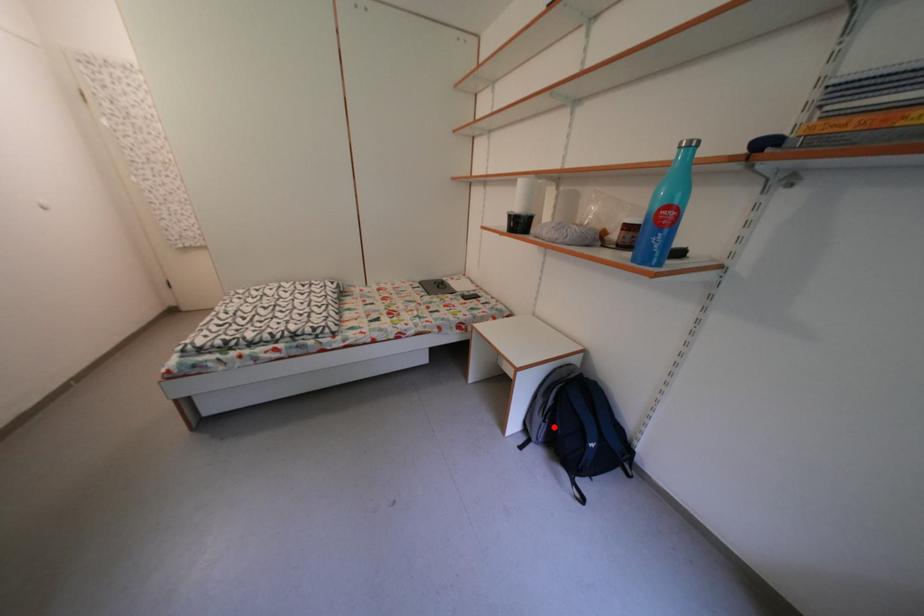
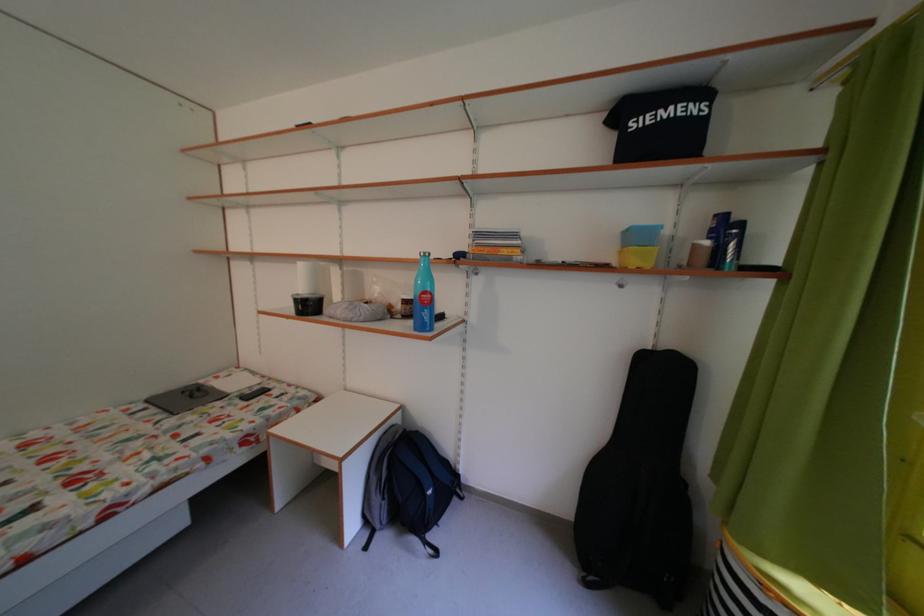
Question: I am providing you with two images of the same scene from different viewpoints. A red point is marked on the first image. Is the red point's position out of view in image 2?

Choices:
 (A) Yes
 (B) No

Answer: (B)